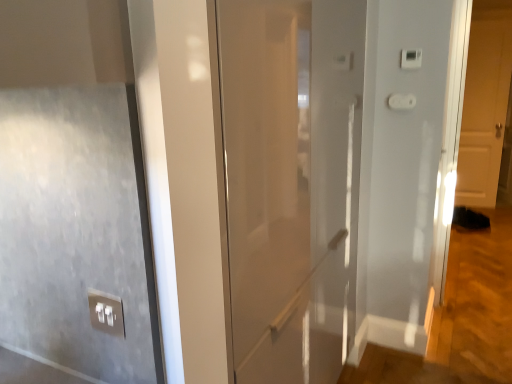
Question: Is satin silver switch at lower left completely or partially outside of white plastic light switch at upper right, the 2th light switch in the top-to-bottom sequence?

Choices:
 (A) yes
 (B) no

Answer: (A)

Question: Does satin silver switch at lower left have a lesser height compared to white plastic light switch at upper right, the 1th light switch ordered from the bottom?

Choices:
 (A) no
 (B) yes

Answer: (A)

Question: From a real-world perspective, is satin silver switch at lower left located beneath white plastic light switch at upper right, the 2th light switch in the top-to-bottom sequence?

Choices:
 (A) no
 (B) yes

Answer: (B)

Question: From the image's perspective, does satin silver switch at lower left appear higher than white plastic light switch at upper right, the 2th light switch in the top-to-bottom sequence?

Choices:
 (A) no
 (B) yes

Answer: (A)

Question: Is satin silver switch at lower left not near white plastic light switch at upper right, the 2th light switch in the top-to-bottom sequence?

Choices:
 (A) yes
 (B) no

Answer: (A)

Question: Is satin silver switch at lower left taller or shorter than white plastic light switch at upper right, the 1th light switch ordered from the bottom?

Choices:
 (A) tall
 (B) short

Answer: (A)

Question: From the image's perspective, relative to white plastic light switch at upper right, the 2th light switch in the top-to-bottom sequence, is satin silver switch at lower left above or below?

Choices:
 (A) above
 (B) below

Answer: (B)

Question: Is satin silver switch at lower left to the left or to the right of white plastic light switch at upper right, the 1th light switch ordered from the bottom, in the image?

Choices:
 (A) left
 (B) right

Answer: (A)

Question: Is satin silver switch at lower left bigger or smaller than white plastic light switch at upper right, the 2th light switch in the top-to-bottom sequence?

Choices:
 (A) big
 (B) small

Answer: (B)

Question: Is white matte door at right, marked as the 2th door in a left-to-right arrangement, situated inside satin silver switch at lower left or outside?

Choices:
 (A) inside
 (B) outside

Answer: (B)

Question: Is white matte door at right, arranged as the first door when viewed from the right, bigger or smaller than satin silver switch at lower left?

Choices:
 (A) big
 (B) small

Answer: (A)

Question: Does point (489, 200) appear closer or farther from the camera than point (118, 334)?

Choices:
 (A) closer
 (B) farther

Answer: (B)

Question: In terms of height, does white matte door at right, marked as the 2th door in a left-to-right arrangement, look taller or shorter compared to satin silver switch at lower left?

Choices:
 (A) short
 (B) tall

Answer: (B)

Question: Would you say white matte door at right, arranged as the 1th door when viewed from the back, is inside or outside white plastic light switch at upper right, acting as the second light switch starting from the bottom?

Choices:
 (A) inside
 (B) outside

Answer: (B)

Question: Is white matte door at right, marked as the 2th door in a front-to-back arrangement, in front of or behind white plastic light switch at upper right, acting as the 1th light switch starting from the top, in the image?

Choices:
 (A) front
 (B) behind

Answer: (B)